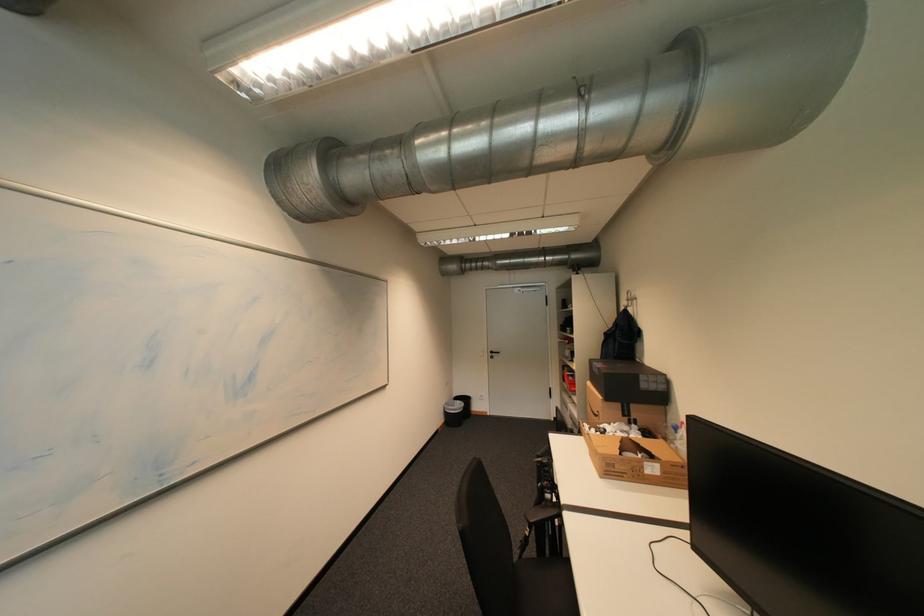
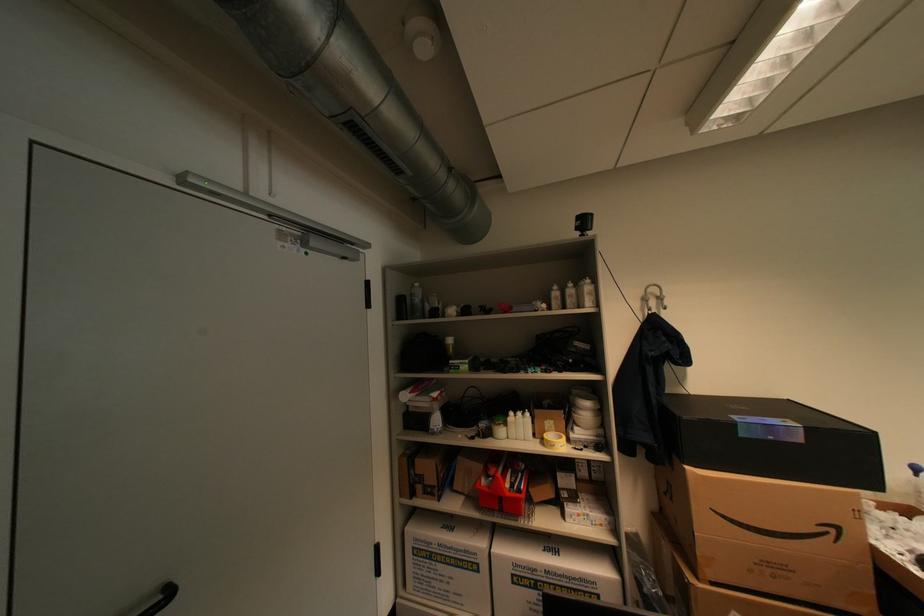
In the second image, find the point that corresponds to (506,353) in the first image.

(176, 594)